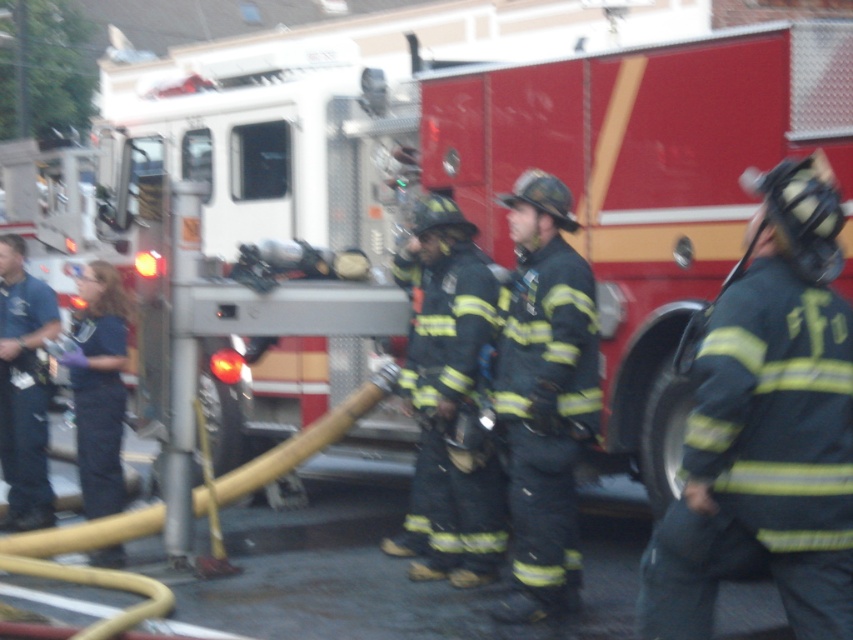
Consider the image. Who is shorter, dark blue uniform at center or black matte uniform at center?

Standing shorter between the two is black matte uniform at center.

Does dark blue uniform at center appear under black matte uniform at center?

Incorrect, dark blue uniform at center is not positioned below black matte uniform at center.

Between point (547, 532) and point (453, 392), which one is positioned behind?

Point (453, 392)

Locate an element on the screen. The height and width of the screenshot is (640, 853). dark blue uniform at center is located at coordinates (544, 396).

Can you confirm if dark gray uniform at center is positioned above dark blue uniform at center?

Yes, dark gray uniform at center is above dark blue uniform at center.

Which is more to the left, dark gray uniform at center or dark blue uniform at center?

dark blue uniform at center

You are a GUI agent. You are given a task and a screenshot of the screen. Output one action in this format:
    pyautogui.click(x=<x>, y=<y>)
    Task: Click on the dark gray uniform at center
    The height and width of the screenshot is (640, 853).
    Given the screenshot: What is the action you would take?
    pyautogui.click(x=766, y=426)

Measure the distance between point [753,289] and camera.

Point [753,289] and camera are 11.53 feet apart from each other.

Is dark gray uniform at center further to the viewer compared to black matte uniform at center?

No, it is not.

This screenshot has width=853, height=640. Find the location of `dark gray uniform at center`. dark gray uniform at center is located at coordinates (766, 426).